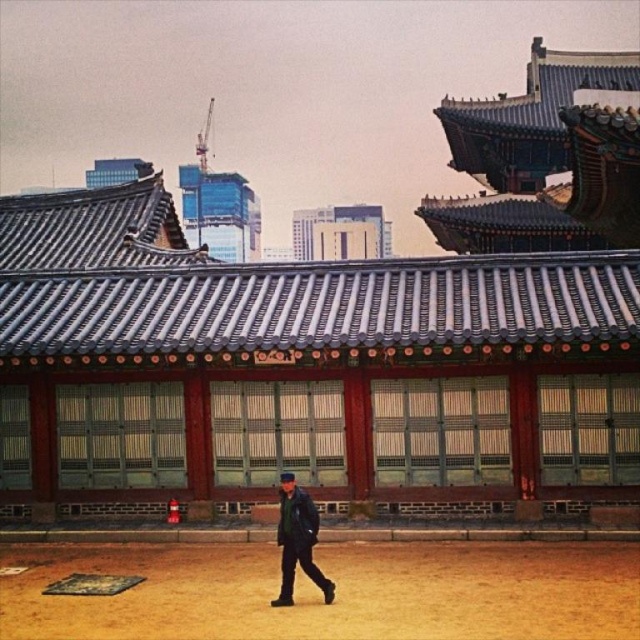
You are standing in the scene and want to walk to the white concrete building at center. Which direction should you move relative to the brown sandy ground at center?

Since the brown sandy ground at center is in front of the white concrete building at center, you should move backward away from the brown sandy ground at center to reach the white concrete building at center.

You are standing in the scene and want to walk towards the white concrete building at center. Which direction should you look to see the brown sandy ground at center first?

The brown sandy ground at center is below the white concrete building at center, so you should look downward to see the brown sandy ground at center first.

You are a photographer trying to capture both the dark blue leather jacket at lower center and the white concrete building at center in a single frame. Considering their sizes, which object should you focus on first to ensure both are in focus?

Since the dark blue leather jacket at lower center is thinner than the white concrete building at center, you should focus on the white concrete building at center first as it is larger and will require more attention to capture details properly.